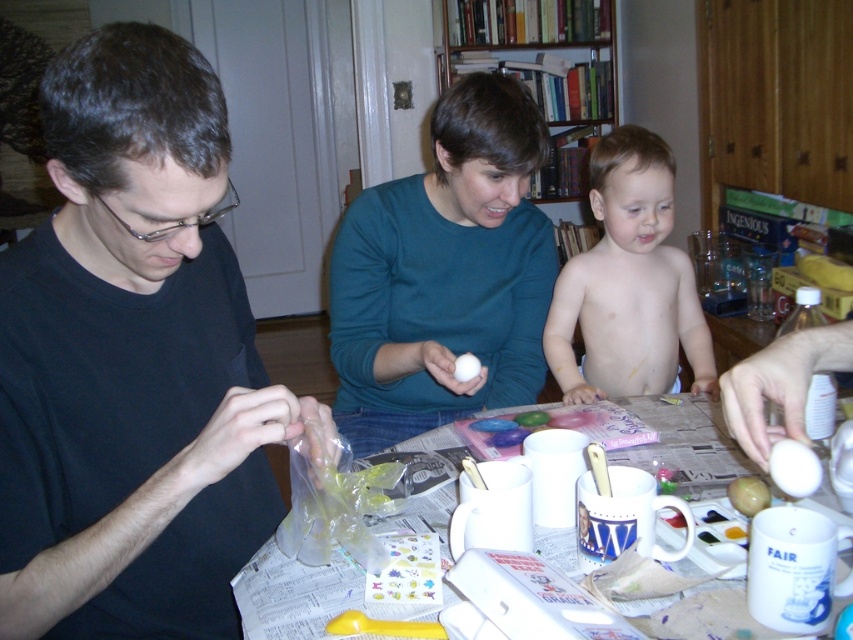
Question: Based on their relative distances, which object is nearer to the teal matte sweater at center?

Choices:
 (A) white glossy egg at center
 (B) white matte egg at center
 (C) black matte shirt at left

Answer: (B)

Question: Which point appears farthest from the camera in this image?

Choices:
 (A) (477, 371)
 (B) (183, 44)
 (C) (521, 212)

Answer: (C)

Question: Is teal matte sweater at center closer to camera compared to white glossy egg at center?

Choices:
 (A) no
 (B) yes

Answer: (A)

Question: Estimate the real-world distances between objects in this image. Which object is farther from the smooth skin baby at center?

Choices:
 (A) teal matte sweater at center
 (B) white paper at center

Answer: (B)

Question: Does teal matte sweater at center have a lesser width compared to white matte egg at center?

Choices:
 (A) no
 (B) yes

Answer: (A)

Question: Is teal matte sweater at center below white matte egg at center?

Choices:
 (A) no
 (B) yes

Answer: (A)